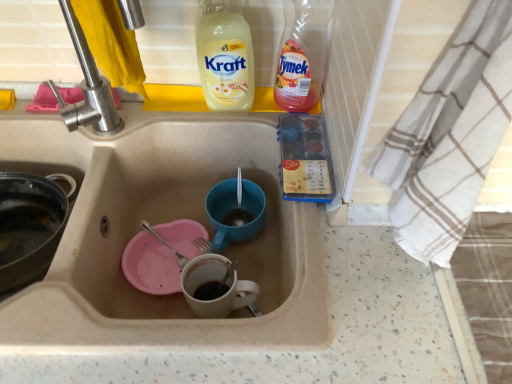
Question: Can you confirm if blue matte cup at center is bigger than white cotton towel at right?

Choices:
 (A) no
 (B) yes

Answer: (A)

Question: Are blue matte cup at center and white cotton towel at right located far from each other?

Choices:
 (A) no
 (B) yes

Answer: (A)

Question: Is blue matte cup at center smaller than white cotton towel at right?

Choices:
 (A) no
 (B) yes

Answer: (B)

Question: From the image's perspective, is blue matte cup at center located above white cotton towel at right?

Choices:
 (A) yes
 (B) no

Answer: (B)

Question: Considering the relative positions of blue matte cup at center and white cotton towel at right in the image provided, is blue matte cup at center in front of white cotton towel at right?

Choices:
 (A) yes
 (B) no

Answer: (B)

Question: Is blue matte cup at center thinner than white cotton towel at right?

Choices:
 (A) no
 (B) yes

Answer: (A)

Question: Is yellow liquid soap at upper center next to beige ceramic sink at center?

Choices:
 (A) no
 (B) yes

Answer: (A)

Question: Does yellow liquid soap at upper center have a smaller size compared to beige ceramic sink at center?

Choices:
 (A) yes
 (B) no

Answer: (A)

Question: Considering the relative sizes of yellow liquid soap at upper center and beige ceramic sink at center in the image provided, is yellow liquid soap at upper center thinner than beige ceramic sink at center?

Choices:
 (A) no
 (B) yes

Answer: (B)

Question: Does yellow liquid soap at upper center have a larger size compared to beige ceramic sink at center?

Choices:
 (A) no
 (B) yes

Answer: (A)

Question: Does yellow liquid soap at upper center have a greater width compared to beige ceramic sink at center?

Choices:
 (A) yes
 (B) no

Answer: (B)

Question: From the image's perspective, does yellow liquid soap at upper center appear higher than beige ceramic sink at center?

Choices:
 (A) yes
 (B) no

Answer: (A)

Question: Is translucent plastic bottle at upper right completely or partially outside of blue matte cup at center?

Choices:
 (A) no
 (B) yes

Answer: (B)